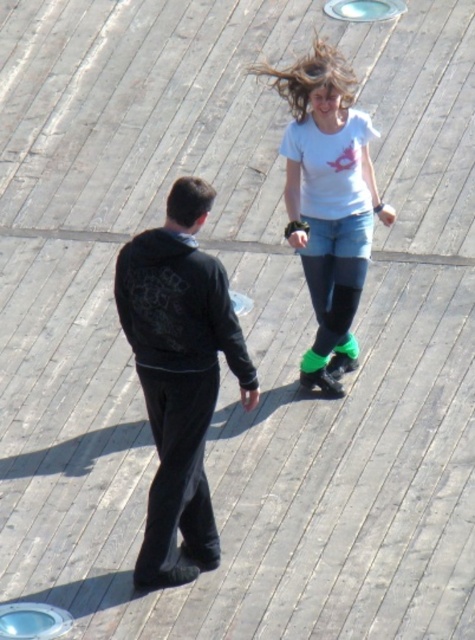
You are standing at the point marked as point [180,376]. What object is located exactly at this point?

The black matte jacket at center is located exactly at point [180,376].